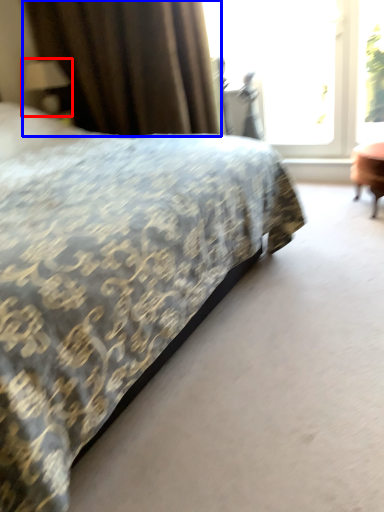
Question: Which of the following is the farthest to the observer, table lamp (highlighted by a red box) or curtain (highlighted by a blue box)?

Choices:
 (A) table lamp
 (B) curtain

Answer: (A)